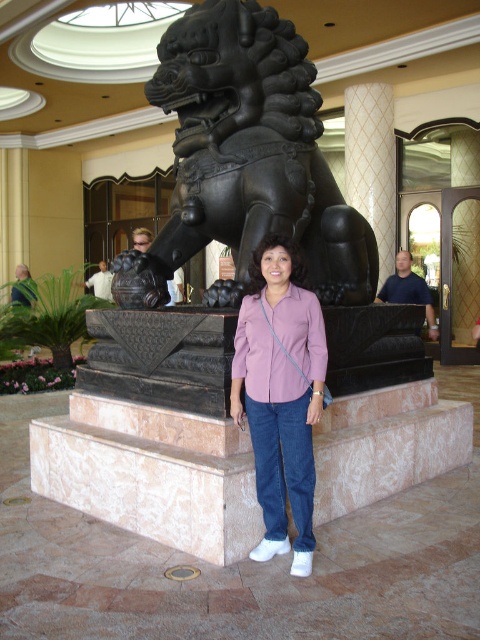
Question: Which point is closer to the camera?

Choices:
 (A) matte purple shirt at center
 (B) white textured pillar at center
 (C) black bronze lion at center
 (D) pink fabric shirt at center

Answer: (D)

Question: Is pink fabric shirt at center below white textured pillar at center?

Choices:
 (A) yes
 (B) no

Answer: (A)

Question: Which point is farther to the camera?

Choices:
 (A) black bronze lion at center
 (B) white textured pillar at center
 (C) pink fabric shirt at center

Answer: (B)

Question: Does black bronze lion at center have a lesser width compared to matte purple shirt at center?

Choices:
 (A) no
 (B) yes

Answer: (A)

Question: Is black bronze lion at center positioned at the back of pink fabric shirt at center?

Choices:
 (A) no
 (B) yes

Answer: (B)

Question: Which point is closer to the camera?

Choices:
 (A) (294, 461)
 (B) (288, 141)
 (C) (384, 256)
 (D) (282, 332)

Answer: (A)